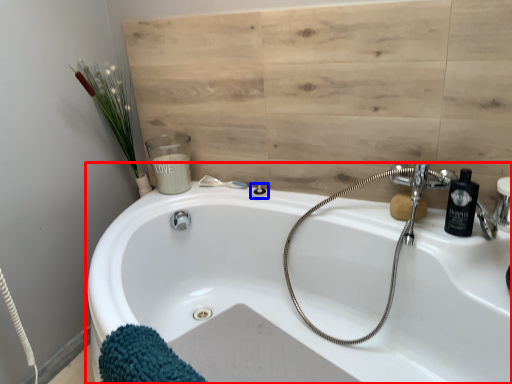
Question: Which point is further to the camera, bathtub (highlighted by a red box) or shower (highlighted by a blue box)?

Choices:
 (A) bathtub
 (B) shower

Answer: (B)